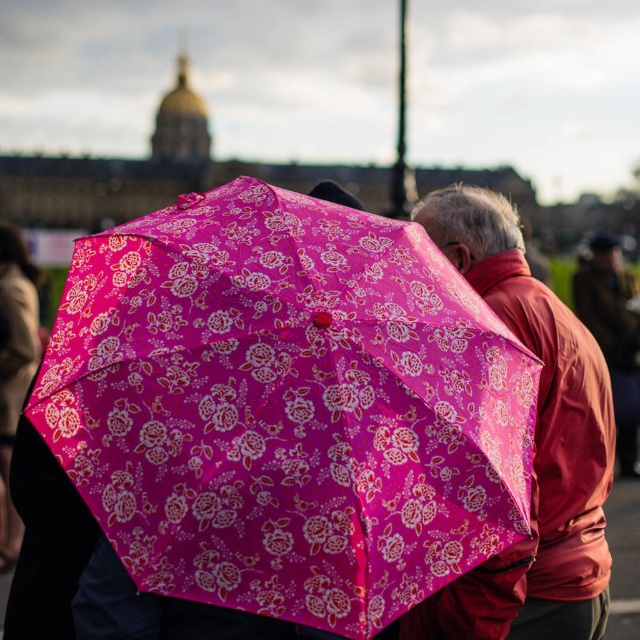
Is matte pink umbrella at center closer to camera compared to pink floral umbrella at upper left?

Yes, matte pink umbrella at center is in front of pink floral umbrella at upper left.

In the scene shown: Can you confirm if matte pink umbrella at center is bigger than pink floral umbrella at upper left?

No, matte pink umbrella at center is not bigger than pink floral umbrella at upper left.

Who is more forward, (433,596) or (20,268)?

Point (433,596)

I want to click on matte pink umbrella at center, so click(534, 445).

Can you confirm if pink fabric umbrella at center is smaller than matte pink umbrella at center?

Correct, pink fabric umbrella at center occupies less space than matte pink umbrella at center.

From the picture: Is pink fabric umbrella at center further to the viewer compared to matte pink umbrella at center?

That is False.

Does point (232, 529) lie behind point (426, 632)?

No, (232, 529) is closer to viewer.

This screenshot has height=640, width=640. Find the location of `pink fabric umbrella at center`. pink fabric umbrella at center is located at coordinates (269, 426).

Can you confirm if pink fabric umbrella at center is shorter than pink floral umbrella at upper left?

Correct, pink fabric umbrella at center is not as tall as pink floral umbrella at upper left.

Consider the image. Who is more forward, (x=196, y=588) or (x=13, y=305)?

Point (x=196, y=588)

This screenshot has height=640, width=640. What are the coordinates of `pink fabric umbrella at center` in the screenshot? It's located at (269, 426).